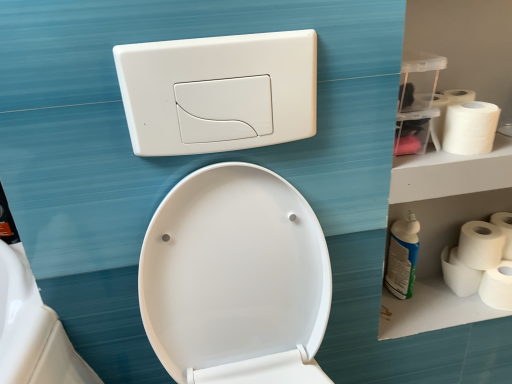
Question: Does blue glossy spray bottle at right have a smaller size compared to white matte toilet paper at right, which is counted as the 4th toilet paper, starting from the bottom?

Choices:
 (A) no
 (B) yes

Answer: (A)

Question: Can you confirm if blue glossy spray bottle at right is positioned to the left of white matte toilet paper at right, the 2th toilet paper viewed from the top?

Choices:
 (A) no
 (B) yes

Answer: (B)

Question: Is blue glossy spray bottle at right closer to camera compared to white matte toilet paper at right, the 2th toilet paper viewed from the top?

Choices:
 (A) yes
 (B) no

Answer: (A)

Question: Does blue glossy spray bottle at right have a lesser width compared to white matte toilet paper at right, which is counted as the 4th toilet paper, starting from the bottom?

Choices:
 (A) no
 (B) yes

Answer: (B)

Question: From a real-world perspective, is blue glossy spray bottle at right below white matte toilet paper at right, the 2th toilet paper viewed from the top?

Choices:
 (A) no
 (B) yes

Answer: (B)

Question: Is blue glossy spray bottle at right oriented away from white matte toilet paper at right, the 2th toilet paper viewed from the top?

Choices:
 (A) no
 (B) yes

Answer: (A)

Question: From the image's perspective, is white matte toilet paper at right, arranged as the 4th toilet paper when viewed from the top, over white matte toilet paper at right, placed as the third toilet paper when sorted from bottom to top?

Choices:
 (A) yes
 (B) no

Answer: (B)

Question: Is white matte toilet paper at right, placed as the third toilet paper when sorted from bottom to top, completely or partially inside white matte toilet paper at right, arranged as the 4th toilet paper when viewed from the top?

Choices:
 (A) no
 (B) yes

Answer: (A)

Question: From a real-world perspective, does white matte toilet paper at right, the second toilet paper ordered from the bottom, stand above white matte toilet paper at right, placed as the third toilet paper when sorted from bottom to top?

Choices:
 (A) yes
 (B) no

Answer: (B)

Question: Is white matte toilet paper at right, arranged as the 4th toilet paper when viewed from the top, positioned with its back to white matte toilet paper at right, placed as the third toilet paper when sorted from bottom to top?

Choices:
 (A) no
 (B) yes

Answer: (A)

Question: Does white matte toilet paper at right, the second toilet paper ordered from the bottom, have a smaller size compared to white matte toilet paper at right, which appears as the third toilet paper when viewed from the top?

Choices:
 (A) no
 (B) yes

Answer: (B)

Question: Are white matte toilet paper at right, the second toilet paper ordered from the bottom, and white matte toilet paper at right, placed as the third toilet paper when sorted from bottom to top, far apart?

Choices:
 (A) no
 (B) yes

Answer: (A)

Question: Is white plastic flush plate at upper center thinner than white matte toilet paper at right, the first toilet paper in the bottom-to-top sequence?

Choices:
 (A) no
 (B) yes

Answer: (B)